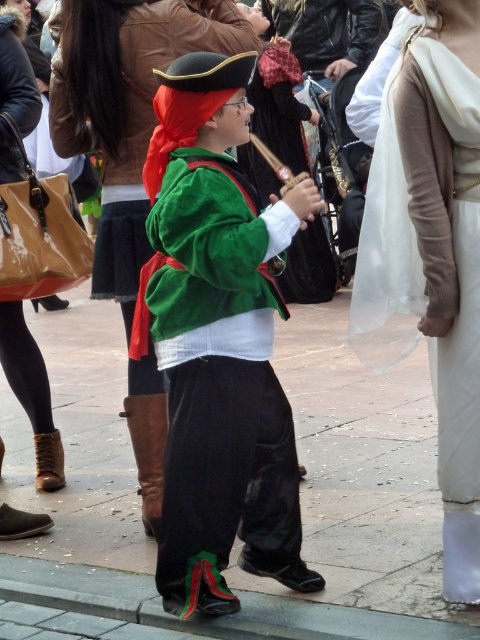
Question: Does smooth concrete pavement at center appear over velvet green jacket at center?

Choices:
 (A) no
 (B) yes

Answer: (A)

Question: Which object appears closest to the camera in this image?

Choices:
 (A) smooth concrete pavement at center
 (B) white satin dress at center
 (C) velvet green jacket at center

Answer: (B)

Question: Which point is farther to the camera?

Choices:
 (A) velvet green jacket at center
 (B) white satin dress at center
 (C) smooth concrete pavement at center

Answer: (C)

Question: Does velvet green jacket at center appear on the right side of white satin dress at center?

Choices:
 (A) yes
 (B) no

Answer: (B)

Question: Is smooth concrete pavement at center smaller than white satin dress at center?

Choices:
 (A) yes
 (B) no

Answer: (A)

Question: Which is farther from the white satin dress at center?

Choices:
 (A) smooth concrete pavement at center
 (B) velvet green jacket at center

Answer: (A)